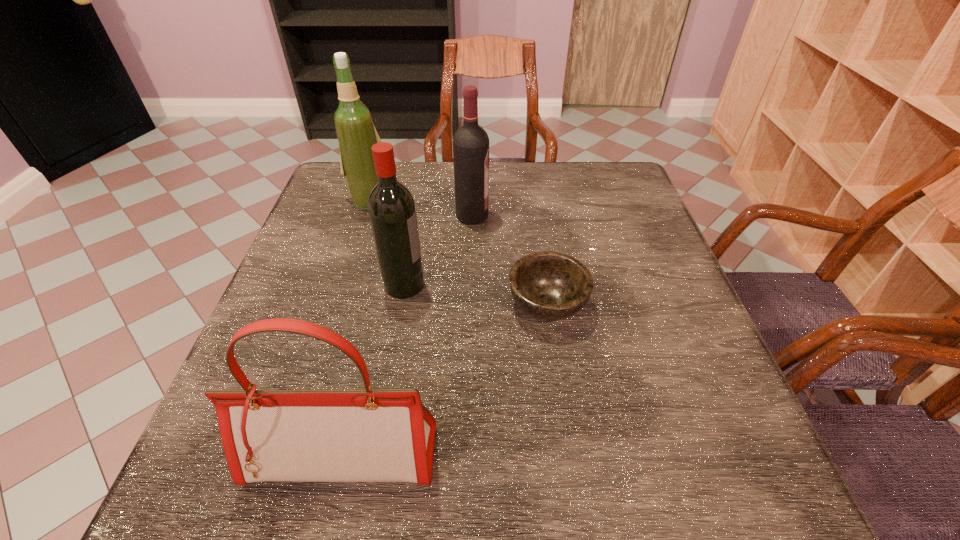
You are a GUI agent. You are given a task and a screenshot of the screen. Output one action in this format:
    pyautogui.click(x=<x>, y=<y>)
    Task: Click on the free space between the bowl and the handbag
    
    Given the screenshot: What is the action you would take?
    445,380

Where is `the fourth closest object to the nearest wine bottle`? This screenshot has width=960, height=540. the fourth closest object to the nearest wine bottle is located at coordinates (366, 435).

This screenshot has height=540, width=960. In order to click on object that is the third closest to the leftmost wine bottle in this screenshot , I will do `click(548, 285)`.

The image size is (960, 540). Find the location of `the closest wine bottle relative to the bowl`. the closest wine bottle relative to the bowl is located at coordinates (392, 212).

The width and height of the screenshot is (960, 540). I want to click on wine bottle that is the closest one to the second wine bottle from right to left, so click(x=471, y=142).

Find the location of a particular element. free space that satisfies the following two spatial constraints: 1. on the label of the rightmost object; 2. on the left side of the second wine bottle from right to left is located at coordinates (401, 305).

Find the location of `free space that satisfies the following two spatial constraints: 1. on the label of the nearest wine bottle; 2. on the left side of the shortest object`. free space that satisfies the following two spatial constraints: 1. on the label of the nearest wine bottle; 2. on the left side of the shortest object is located at coordinates (401, 305).

At what (x,y) coordinates should I click in order to perform the action: click on free space that satisfies the following two spatial constraints: 1. on the label of the shortest object; 2. on the left side of the rightmost wine bottle. Please return your answer as a coordinate pair (x, y). This screenshot has width=960, height=540. Looking at the image, I should click on [470, 305].

Find the location of a particular element. This screenshot has height=540, width=960. free space that satisfies the following two spatial constraints: 1. on the label of the bowl; 2. on the left side of the rightmost wine bottle is located at coordinates (470, 305).

The height and width of the screenshot is (540, 960). I want to click on free region that satisfies the following two spatial constraints: 1. on the front-facing side of the leftmost wine bottle; 2. on the left side of the rightmost object, so click(339, 305).